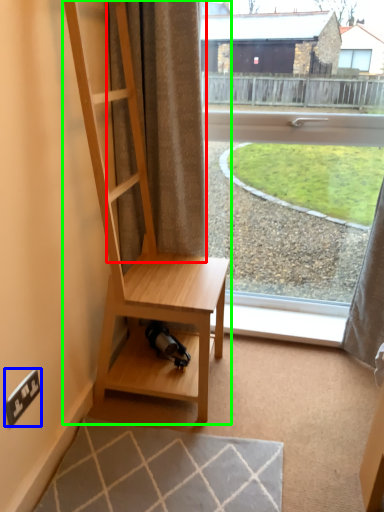
Question: Estimate the real-world distances between objects in this image. Which object is closer to curtain (highlighted by a red box), electric outlet (highlighted by a blue box) or shelf (highlighted by a green box)?

Choices:
 (A) electric outlet
 (B) shelf

Answer: (B)